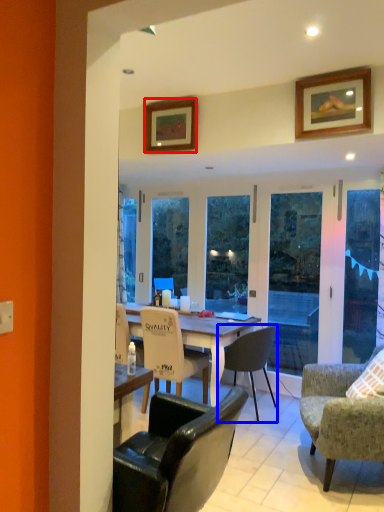
Question: Which of the following is the closest to the observer, picture frame (highlighted by a red box) or chair (highlighted by a blue box)?

Choices:
 (A) picture frame
 (B) chair

Answer: (A)